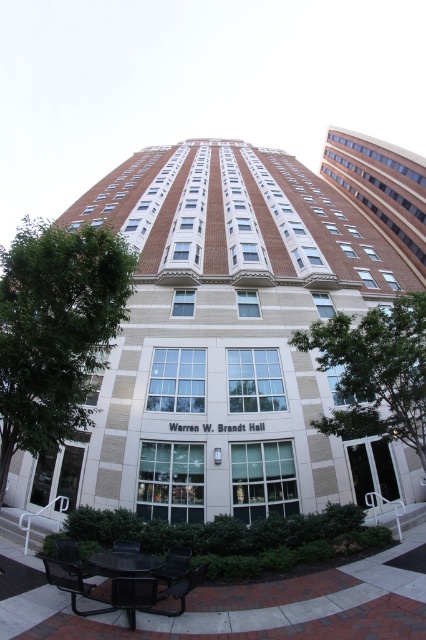
Question: Which object is farther from the camera taking this photo?

Choices:
 (A) metallic silver bench at lower left
 (B) black plastic park bench at lower center

Answer: (B)

Question: Does brick textured building at upper right appear under black metal bench at lower left?

Choices:
 (A) no
 (B) yes

Answer: (A)

Question: Based on their relative distances, which object is farther from the metallic silver bench at lower left?

Choices:
 (A) black plastic park bench at lower center
 (B) black metal bench at lower left
 (C) brick building at center

Answer: (C)

Question: Observing the image, what is the correct spatial positioning of brick textured building at upper right in reference to black metal bench at lower left?

Choices:
 (A) below
 (B) above

Answer: (B)

Question: Which object appears farthest from the camera in this image?

Choices:
 (A) black metal bench at lower left
 (B) metallic silver bench at lower left
 (C) brick textured building at upper right

Answer: (C)

Question: Considering the relative positions of brick textured building at upper right and metallic silver bench at lower left in the image provided, where is brick textured building at upper right located with respect to metallic silver bench at lower left?

Choices:
 (A) right
 (B) left

Answer: (A)